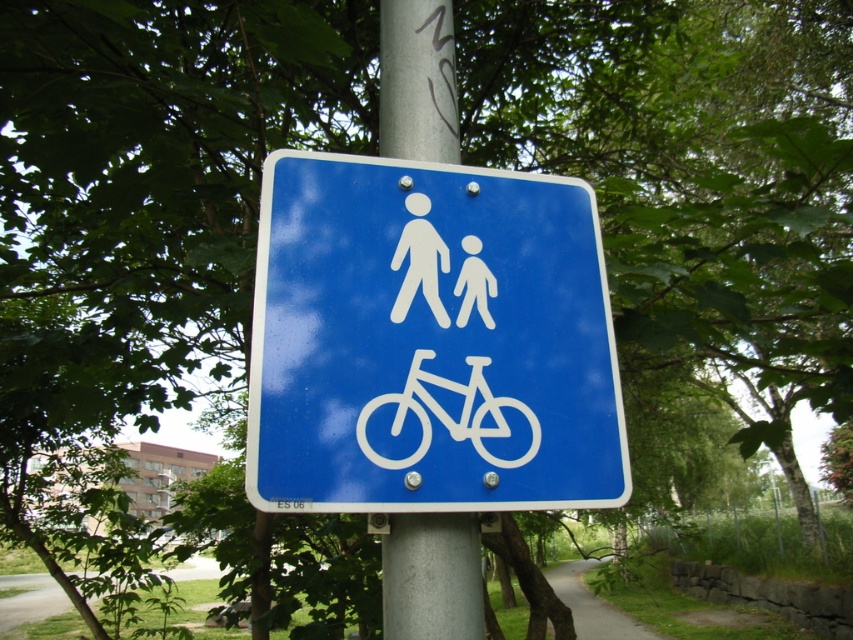
You are standing on the paved path in the park and see two points marked on the sign. The first point is at coordinates point (x=358, y=244) and the second is at point (x=468, y=394). Which point is closer to you?

Point (x=358, y=244) is closer to you because it is further to the viewer than point (x=468, y=394).

You are a delivery person with a 16 inch wide box that needs to be placed between the silver metallic pole at center and the white plastic bicycle at center. Can the box fit in the space between them?

The silver metallic pole at center is 16.62 inches away from the white plastic bicycle at center. Since the box is 16 inches wide, it can fit in the space between them as the distance is slightly larger than the box.

You are standing at the origin point of the coordinate system, which is the bottom left corner of the image. The blue plastic sign at center is at point (428,340). If you want to walk directly towards the blue plastic sign at center, in which direction should you move relative to the image?

Since the blue plastic sign at center is located at point (428,340) in the coordinate system where the origin is the bottom left corner, you should move diagonally upwards and to the right to reach it.